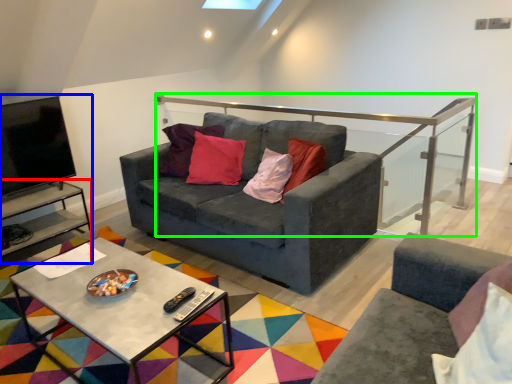
Question: Considering the real-world distances, which object is closest to side table (highlighted by a red box)? entertainment center (highlighted by a blue box) or balustrade (highlighted by a green box).

Choices:
 (A) entertainment center
 (B) balustrade

Answer: (A)